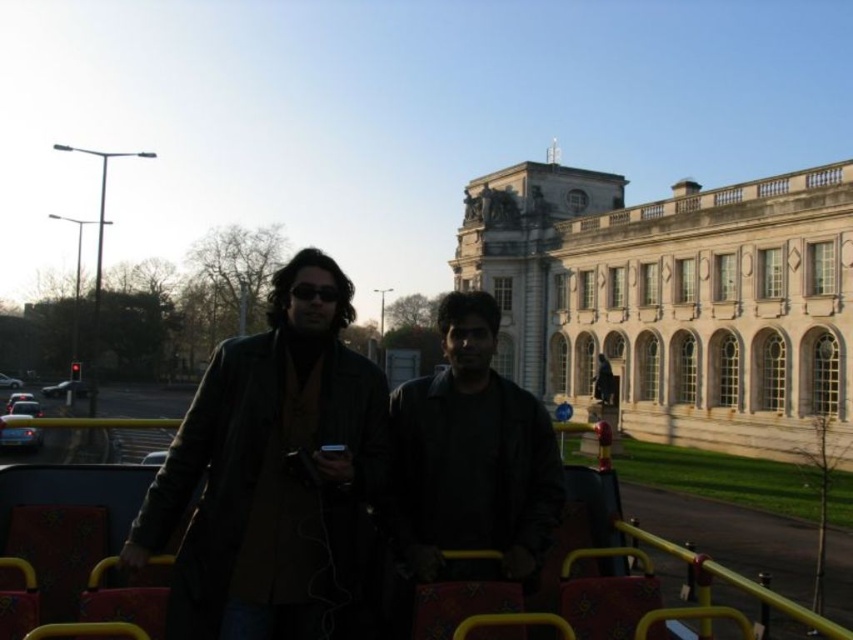
You are standing on the upper deck of a bus and want to take a photo of the white stone building at center. Where should you point your camera to capture it?

You should point your camera towards the coordinates point at [674,300] to capture the white stone building at center.

You are standing on the upper deck of a sightseeing bus and want to take a photo of the white stone building at center. There is a point marked at coordinates (674, 300). Is this point located on the white stone building at center?

Yes, the point (674, 300) is on the white stone building at center, so it is located on the building.